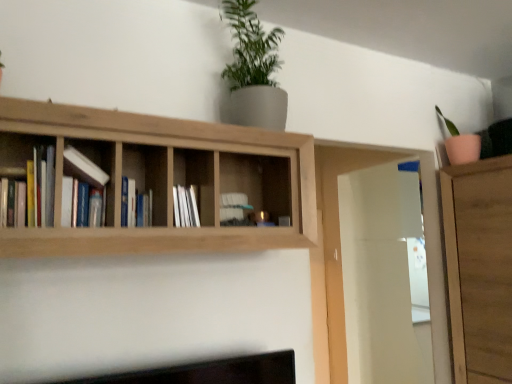
Question: From the image's perspective, is blue hardcover book at center, which is counted as the 1th book, starting from the back, above white glossy cabinet at center?

Choices:
 (A) yes
 (B) no

Answer: (A)

Question: From a real-world perspective, is blue hardcover book at center, which is counted as the 1th book, starting from the back, positioned over white glossy cabinet at center based on gravity?

Choices:
 (A) no
 (B) yes

Answer: (B)

Question: Is blue hardcover book at center, the 2th book when ordered from front to back, taller than white glossy cabinet at center?

Choices:
 (A) no
 (B) yes

Answer: (B)

Question: Considering the relative positions of blue hardcover book at center, which is counted as the 1th book, starting from the back, and white glossy cabinet at center in the image provided, is blue hardcover book at center, which is counted as the 1th book, starting from the back, to the right of white glossy cabinet at center from the viewer's perspective?

Choices:
 (A) no
 (B) yes

Answer: (A)

Question: Is blue hardcover book at center, the 2th book when ordered from front to back, wider than white glossy cabinet at center?

Choices:
 (A) no
 (B) yes

Answer: (A)

Question: Considering the positions of blue hardcover book at center, which is counted as the 1th book, starting from the back, and light brown wood shelf at upper center in the image, is blue hardcover book at center, which is counted as the 1th book, starting from the back, taller or shorter than light brown wood shelf at upper center?

Choices:
 (A) short
 (B) tall

Answer: (A)

Question: In the image, is blue hardcover book at center, which is counted as the 1th book, starting from the back, positioned in front of or behind light brown wood shelf at upper center?

Choices:
 (A) behind
 (B) front

Answer: (A)

Question: Is point (140, 210) closer or farther from the camera than point (210, 153)?

Choices:
 (A) closer
 (B) farther

Answer: (A)

Question: From a real-world perspective, relative to light brown wood shelf at upper center, is blue hardcover book at center, the 2th book when ordered from front to back, vertically above or below?

Choices:
 (A) above
 (B) below

Answer: (B)

Question: In terms of height, does white glossy cabinet at center look taller or shorter compared to green matte plant at upper center?

Choices:
 (A) short
 (B) tall

Answer: (A)

Question: From the image's perspective, is white glossy cabinet at center above or below green matte plant at upper center?

Choices:
 (A) below
 (B) above

Answer: (A)

Question: From a real-world perspective, is white glossy cabinet at center positioned above or below green matte plant at upper center?

Choices:
 (A) below
 (B) above

Answer: (A)

Question: In terms of width, does white glossy cabinet at center look wider or thinner when compared to green matte plant at upper center?

Choices:
 (A) wide
 (B) thin

Answer: (B)

Question: From their relative heights in the image, would you say light brown wood shelf at upper center is taller or shorter than blue hardcover book at center, the 2th book when ordered from front to back?

Choices:
 (A) short
 (B) tall

Answer: (B)

Question: Is light brown wood shelf at upper center inside or outside of blue hardcover book at center, which is counted as the 1th book, starting from the back?

Choices:
 (A) outside
 (B) inside

Answer: (A)